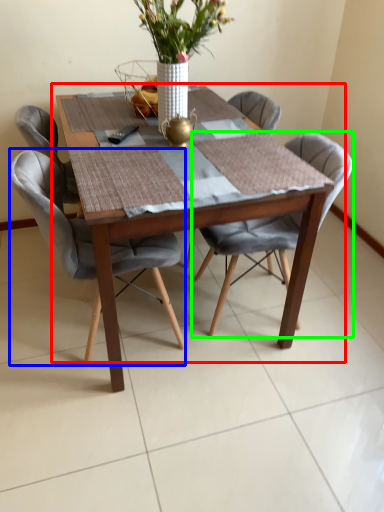
Question: Which object is the closest to the kitchen & dining room table (highlighted by a red box)? Choose among these: chair (highlighted by a blue box) or chair (highlighted by a green box).

Choices:
 (A) chair
 (B) chair

Answer: (A)